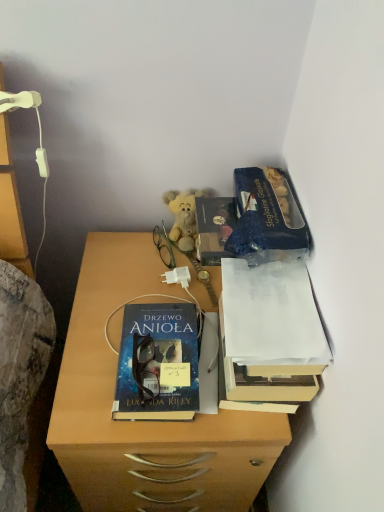
Find the location of `vacant point to the left of green plastic glasses at center`. vacant point to the left of green plastic glasses at center is located at coordinates (114, 254).